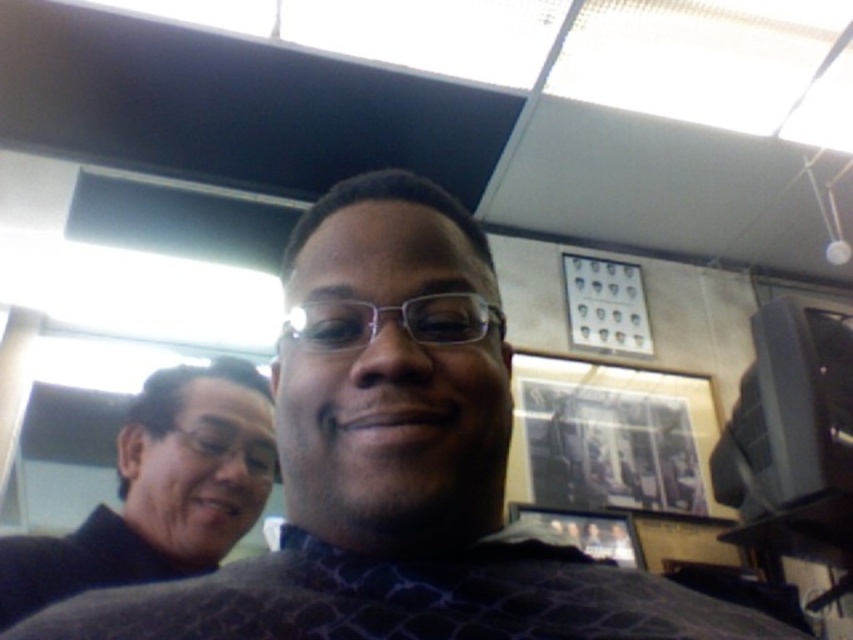
Does point (135, 609) come behind point (151, 406)?

No, (135, 609) is closer to viewer.

Can you confirm if matte black shirt at center is positioned to the right of black matte sweater at left?

Indeed, matte black shirt at center is positioned on the right side of black matte sweater at left.

Between point (285, 388) and point (39, 604), which one is positioned behind?

The point (39, 604) is more distant.

Locate an element on the screen. The image size is (853, 640). matte black shirt at center is located at coordinates (397, 465).